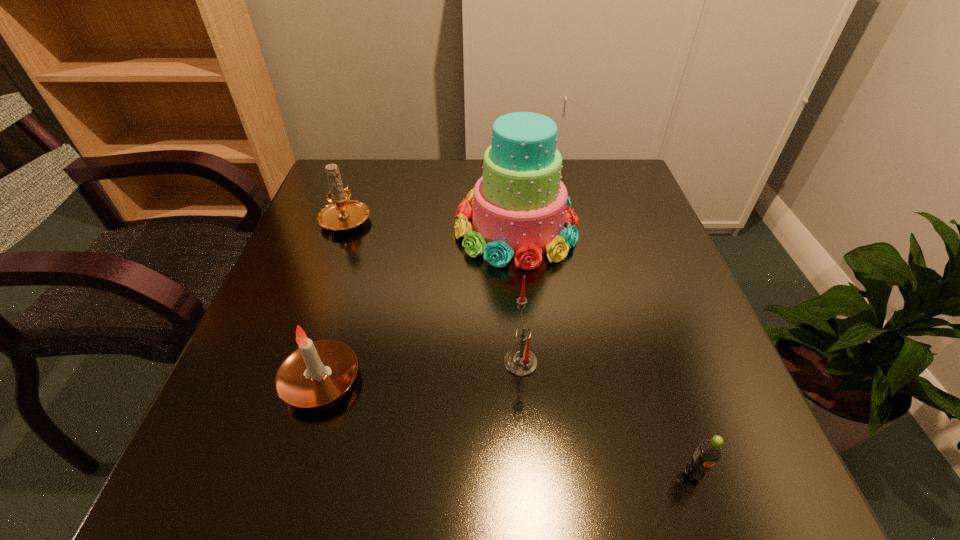
This screenshot has width=960, height=540. What are the coordinates of `object that stands as the third closest to the tallest object` in the screenshot? It's located at pos(316,373).

Point out which candle is positioned as the second nearest to the rightmost candle. Please provide its 2D coordinates. Your answer should be formatted as a tuple, i.e. [(x, y)], where the tuple contains the x and y coordinates of a point satisfying the conditions above.

[(343, 214)]

The image size is (960, 540). Identify the location of candle that can be found as the third closest to the soda. (343, 214).

You are a GUI agent. You are given a task and a screenshot of the screen. Output one action in this format:
    pyautogui.click(x=<x>, y=<y>)
    Task: Click on the vacant position in the image that satisfies the following two spatial constraints: 1. on the front side of the cake; 2. on the left side of the farthest candle
    This screenshot has height=540, width=960.
    Given the screenshot: What is the action you would take?
    pyautogui.click(x=343, y=227)